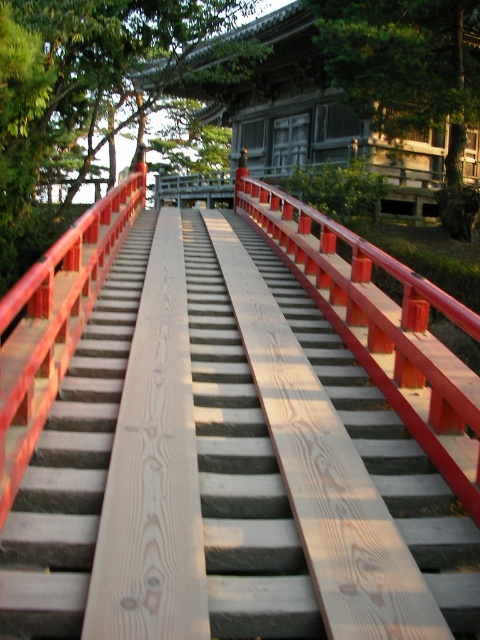
Does point (433, 480) come behind point (130, 51)?

No, (433, 480) is in front of (130, 51).

Between wooden stairs at center and green leafy tree at upper left, which one is positioned lower?

wooden stairs at center is below.

Who is more distant from viewer, (417,544) or (24,154)?

Point (24,154)

Image resolution: width=480 pixels, height=640 pixels. In order to click on wooden stairs at center in this screenshot , I will do pyautogui.click(x=227, y=467).

Can you confirm if green leafy tree at upper left is smaller than green leafy tree at upper center?

No, green leafy tree at upper left is not smaller than green leafy tree at upper center.

Between green leafy tree at upper left and green leafy tree at upper center, which one is positioned higher?

green leafy tree at upper left

Does point (1, 148) lie behind point (427, 74)?

No.

Find the location of `green leafy tree at upper left`. green leafy tree at upper left is located at coordinates (80, 97).

Between wooden stairs at center and green leafy tree at upper center, which one has more height?

With more height is green leafy tree at upper center.

Is point (7, 538) closer to viewer compared to point (396, 58)?

Yes, point (7, 538) is closer to viewer.

Is point (248, 628) positioned in front of point (407, 61)?

That is True.

The height and width of the screenshot is (640, 480). I want to click on wooden stairs at center, so click(x=227, y=467).